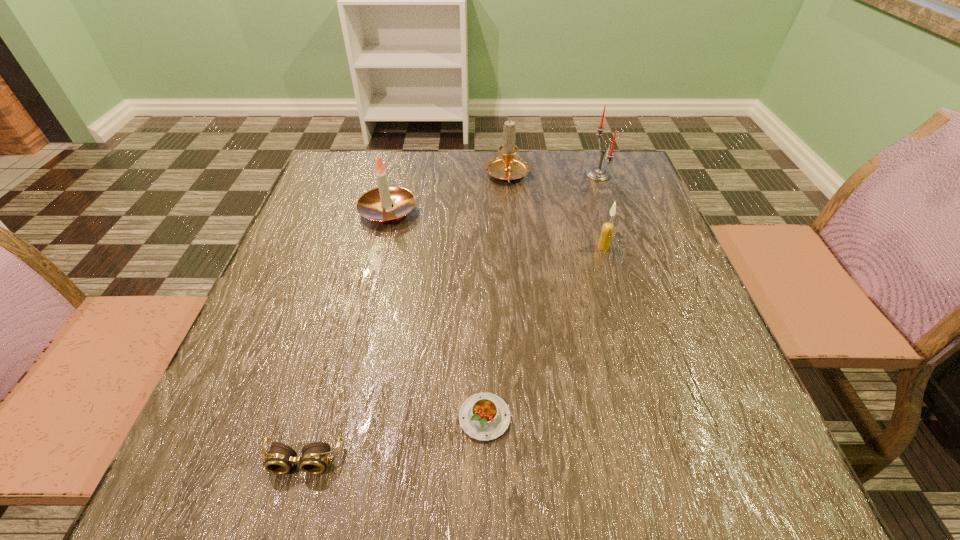
I want to click on empty location between the fourth nearest object and the shortest object, so click(436, 315).

Locate which object is the fourth closest to the nearest object. Please provide its 2D coordinates. Your answer should be formatted as a tuple, i.e. [(x, y)], where the tuple contains the x and y coordinates of a point satisfying the conditions above.

[(507, 167)]

Image resolution: width=960 pixels, height=540 pixels. Find the location of `object that is the fifth closest to the nearest object`. object that is the fifth closest to the nearest object is located at coordinates (599, 174).

Locate which candle ranks third in proximity to the third farthest candle. Please provide its 2D coordinates. Your answer should be formatted as a tuple, i.e. [(x, y)], where the tuple contains the x and y coordinates of a point satisfying the conditions above.

[(599, 174)]

Where is `candle that can be found as the third closest to the fourth nearest object`? The height and width of the screenshot is (540, 960). candle that can be found as the third closest to the fourth nearest object is located at coordinates (599, 174).

At what (x,y) coordinates should I click in order to perform the action: click on free location that satisfies the following two spatial constraints: 1. on the front-facing side of the rightmost candle; 2. on the front side of the third candle from right to left. Please return your answer as a coordinate pair (x, y). This screenshot has width=960, height=540. Looking at the image, I should click on (599, 177).

Locate an element on the screen. vacant space that satisfies the following two spatial constraints: 1. on the back side of the third candle from right to left; 2. on the left side of the fourth nearest object is located at coordinates (396, 177).

The image size is (960, 540). Identify the location of vacant region that satisfies the following two spatial constraints: 1. on the front-facing side of the rightmost candle; 2. through the lenses of the nearest object. (697, 460).